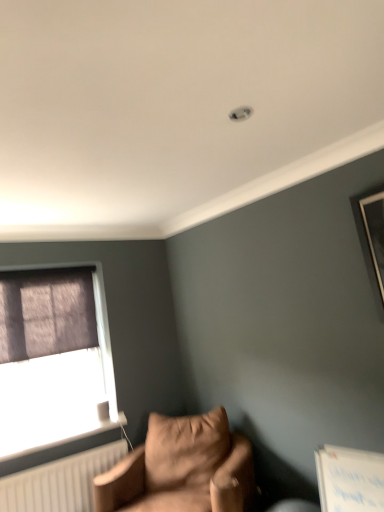
Question: Is suede-like brown armchair at lower left bigger than white plastic radiator at lower left?

Choices:
 (A) yes
 (B) no

Answer: (A)

Question: From the image's perspective, is suede-like brown armchair at lower left on white plastic radiator at lower left?

Choices:
 (A) yes
 (B) no

Answer: (B)

Question: Is suede-like brown armchair at lower left in front of white plastic radiator at lower left?

Choices:
 (A) no
 (B) yes

Answer: (B)

Question: Can you confirm if suede-like brown armchair at lower left is smaller than white plastic radiator at lower left?

Choices:
 (A) yes
 (B) no

Answer: (B)

Question: Is suede-like brown armchair at lower left behind white plastic radiator at lower left?

Choices:
 (A) no
 (B) yes

Answer: (A)

Question: Is suede-like brown armchair at lower left beside white plastic radiator at lower left?

Choices:
 (A) no
 (B) yes

Answer: (A)

Question: Does white plastic radiator at lower left have a lesser width compared to dark purple fabric at left?

Choices:
 (A) no
 (B) yes

Answer: (A)

Question: Is white plastic radiator at lower left in contact with dark purple fabric at left?

Choices:
 (A) no
 (B) yes

Answer: (A)

Question: Does white plastic radiator at lower left come behind dark purple fabric at left?

Choices:
 (A) yes
 (B) no

Answer: (B)

Question: Is white plastic radiator at lower left shorter than dark purple fabric at left?

Choices:
 (A) yes
 (B) no

Answer: (A)

Question: From the image's perspective, is white plastic radiator at lower left located beneath dark purple fabric at left?

Choices:
 (A) no
 (B) yes

Answer: (B)

Question: From a real-world perspective, is white plastic radiator at lower left located beneath dark purple fabric at left?

Choices:
 (A) no
 (B) yes

Answer: (B)

Question: Does white plastic radiator at lower left come in front of matte purple curtain at left?

Choices:
 (A) no
 (B) yes

Answer: (B)